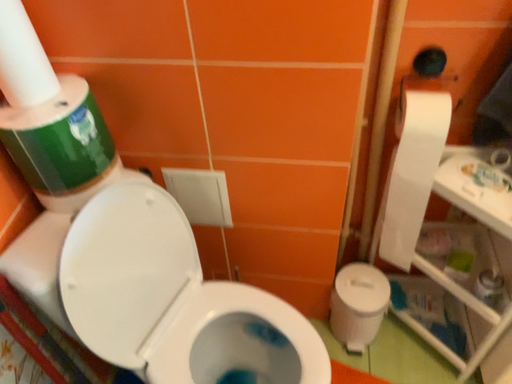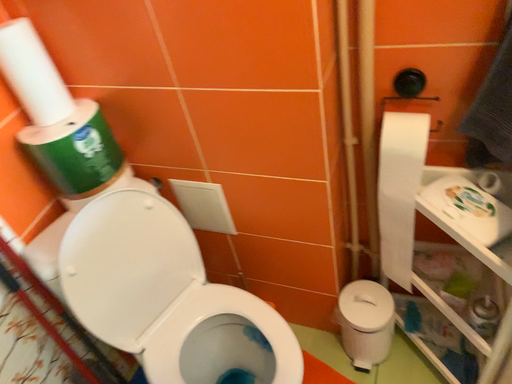
Question: How did the camera likely rotate when shooting the video?

Choices:
 (A) rotated right
 (B) rotated left

Answer: (B)